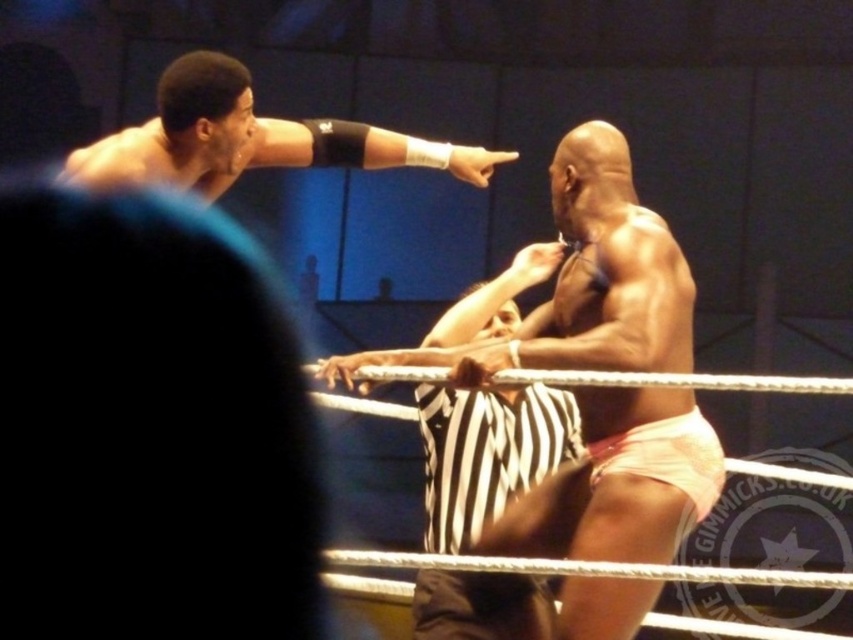
Based on the scene description, where is the pink fabric shorts at center located in the wrestling ring?

The pink fabric shorts at center is located at point 0.442 on the x axis and 0.686 on the y axis.

You are a photographer at the wrestling match. You need to capture a closeup shot of both the pink fabric shorts at center and the matte black arm at upper left in the same frame. Which object should you zoom in on first to ensure both are visible?

You should zoom in on the pink fabric shorts at center first because it is larger than the matte black arm at upper left, allowing you to frame both objects effectively without losing detail on the smaller one.

You are standing at the edge of the wrestling ring and want to touch the point at coordinates point (x=572, y=337). If you stretch your arm fully, which can reach up to 2 meters, can you reach that point?

The point (x=572, y=337) is 2.65 meters away from viewer, so no, you cannot reach it with a 2 meter arm stretch.